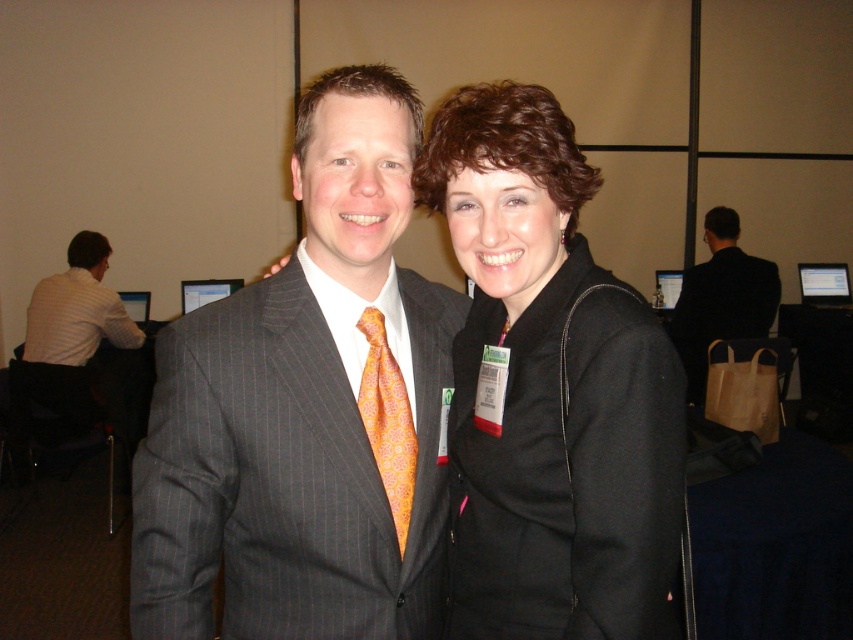
You are standing in the room shown in the scene and need to locate the black wool coat at center. According to the coordinates provided, where would you find it?

The black wool coat at center is located at coordinates point (x=550, y=388).

You are a photographer positioned at the front of the room. You need to take a photo of both the matte pinstripe suit at center and the black suit at right. Which one should you focus on first to ensure both are in sharp focus?

You should focus on the matte pinstripe suit at center first because it is closer to the viewer than the black suit at right. By focusing on the closer object, the depth of field may still keep the farther black suit at right in acceptable focus.

You are standing 40 inches away from the camera. You want to take a photo of the matte pinstripe suit at center. Is the suit within your camera range if the camera can capture objects up to 35 inches away?

The matte pinstripe suit at center is 36.06 inches away from the camera, which is beyond the camera range of 35 inches. Therefore, the suit is out of range and cannot be captured clearly.